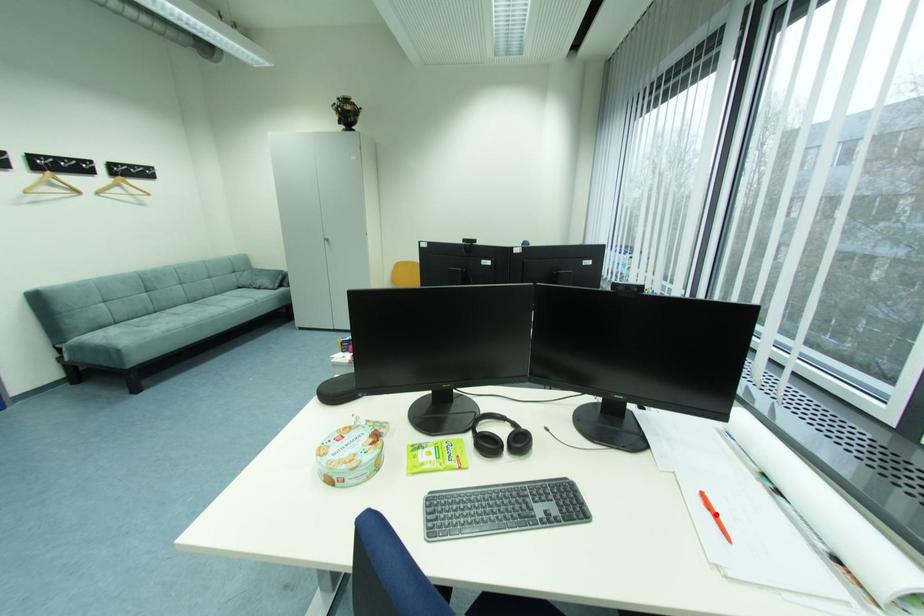
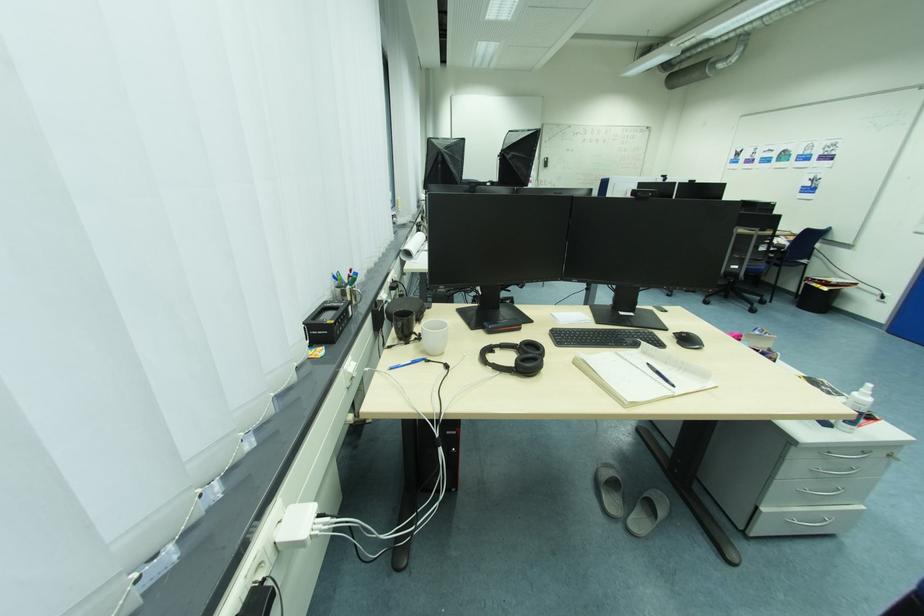
Question: I am providing you with two images of the same scene from different viewpoints. A red point is marked on the first image. At the location where the point appears in image 1, is it still visible in image 2?

Choices:
 (A) Yes
 (B) No

Answer: (B)